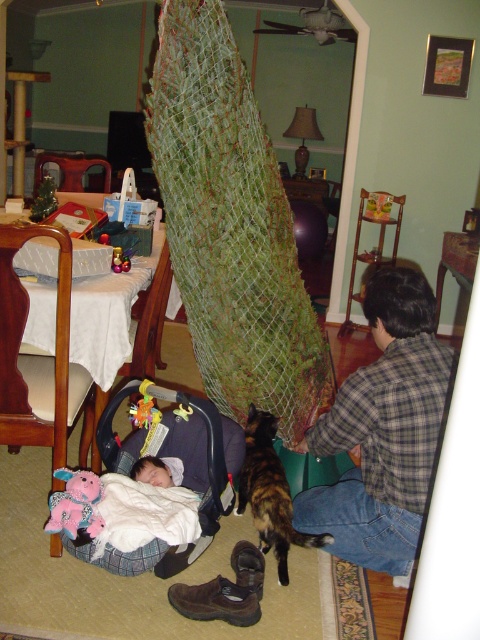
Question: Can you confirm if green netted tree at center is positioned above white soft blanket at center?

Choices:
 (A) yes
 (B) no

Answer: (A)

Question: Which object is the closest to the brushed metal chair at upper left?

Choices:
 (A) plaid shirt at lower right
 (B) plush fabric baby carriage at lower left

Answer: (B)

Question: Is plush fabric baby carriage at lower left positioned at the back of brushed metal chair at upper left?

Choices:
 (A) yes
 (B) no

Answer: (B)

Question: Which object is positioned closest to the plaid shirt at lower right?

Choices:
 (A) calico fur cat at lower center
 (B) white soft blanket at center
 (C) brushed metal chair at upper left

Answer: (A)

Question: Among these objects, which one is nearest to the camera?

Choices:
 (A) brushed metal chair at upper left
 (B) green netted tree at center

Answer: (B)

Question: Can you confirm if plush fabric baby carriage at lower left is smaller than soft white blanket at lower left?

Choices:
 (A) no
 (B) yes

Answer: (A)